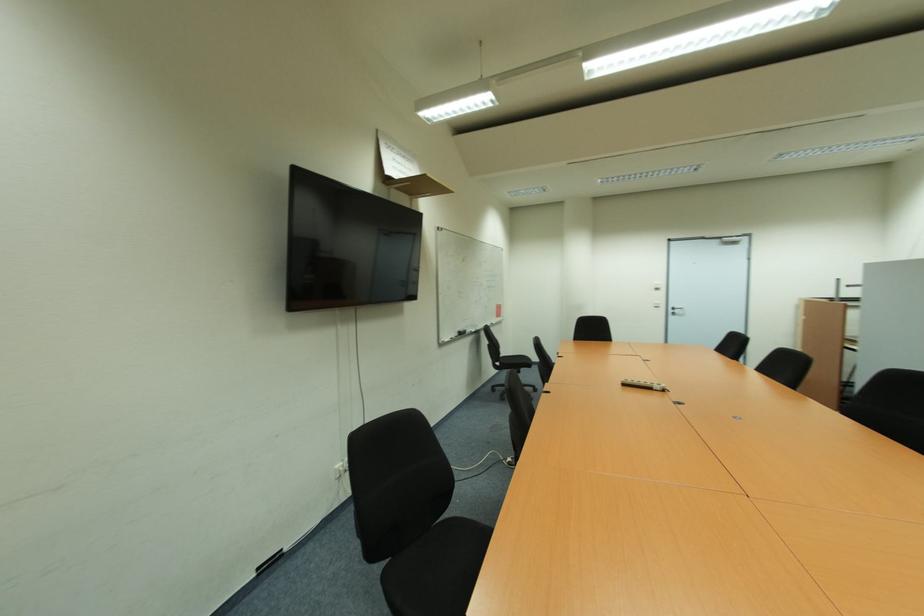
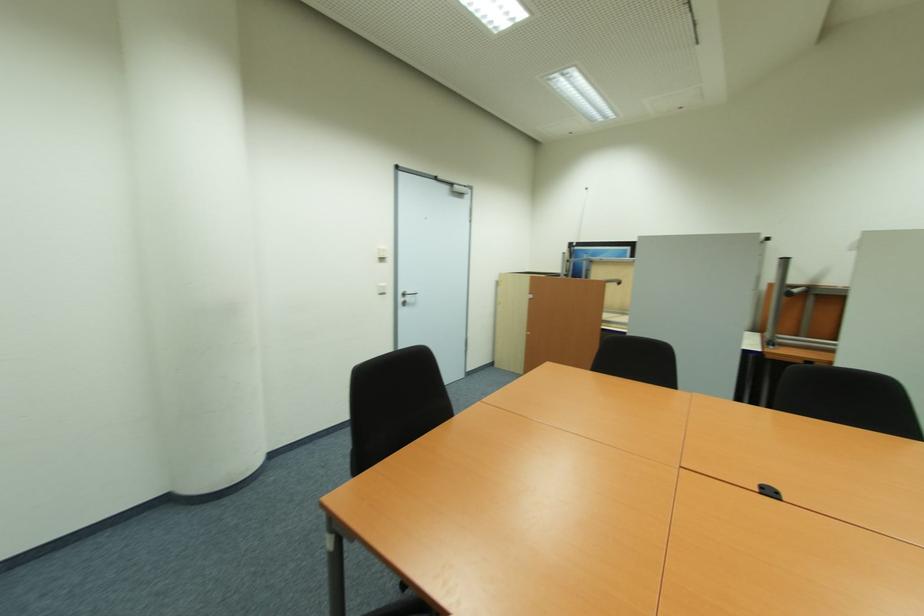
Where in the second image is the point corresponding to point 659,308 from the first image?

(383, 294)